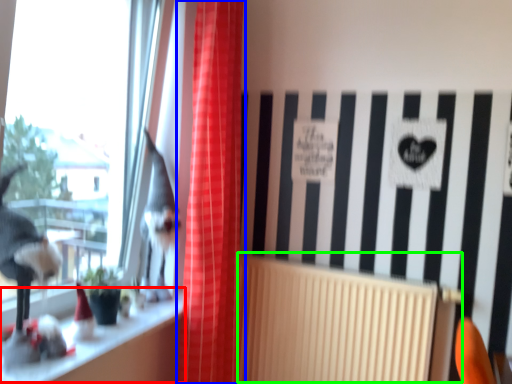
Question: Which object is the farthest from window sill (highlighted by a red box)? Choose among these: curtain (highlighted by a blue box) or radiator (highlighted by a green box).

Choices:
 (A) curtain
 (B) radiator

Answer: (B)